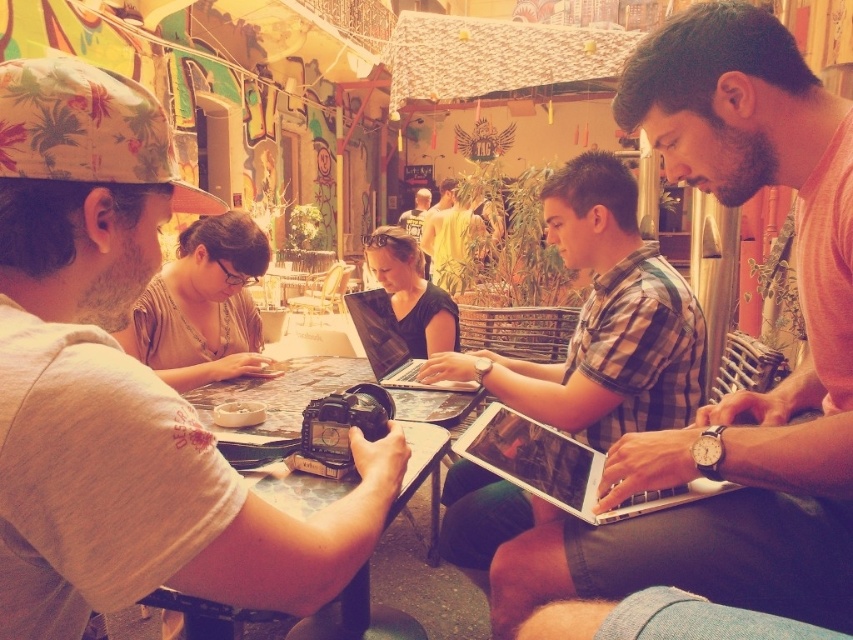
You are a photographer trying to capture a closeup shot of both the matte black laptop at center and the silver metallic laptop at center without moving the camera position. Given that your camera has a maximum focus range of 10 inches, can you achieve this?

The matte black laptop at center and silver metallic laptop at center are 10.01 inches apart from each other, so the distance between them exceeds the camera maximum focus range of 10 inches. Therefore, you cannot achieve this.

You are standing in the outdoor setting and want to take a photo of the person wearing the matte brown shirt at center. Where should you position yourself to ensure the shirt is in the frame?

The matte brown shirt at center is located at point (202, 307), so you should position yourself in the center of the scene to capture it in the frame.

You are organizing a workshop and need to place two laptops on a narrow table. The table can only accommodate one laptop at a time. Which laptop from the scene should you choose to fit on the table, the matte black laptop at center or the silver metallic laptop at center?

The silver metallic laptop at center should be chosen because the matte black laptop at center is wider, so the silver metallic laptop at center will fit better on the narrow table that can only accommodate one laptop at a time.